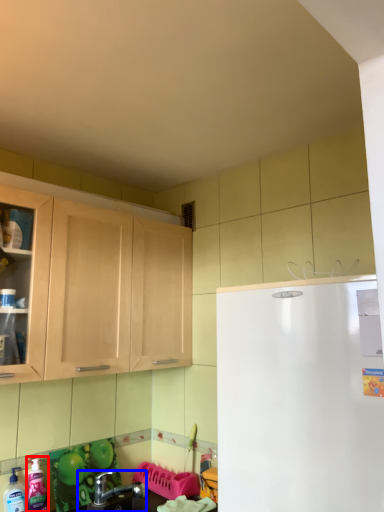
Question: Which object is closer to the camera taking this photo, cleaning product (highlighted by a red box) or sink (highlighted by a blue box)?

Choices:
 (A) cleaning product
 (B) sink

Answer: (B)